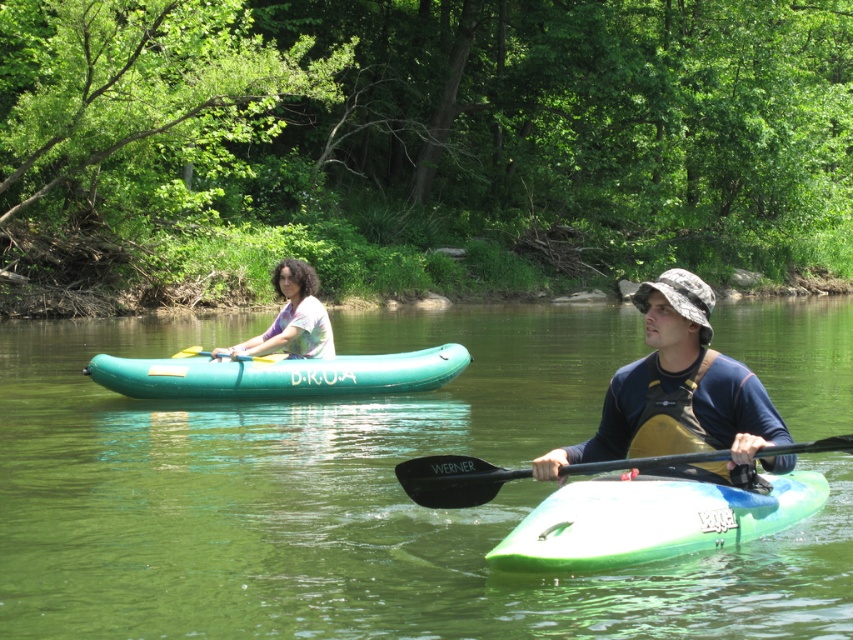
Between green rubber kayak at center and black rubber paddle at upper center, which one appears on the right side from the viewer's perspective?

green rubber kayak at center is more to the right.

What do you see at coordinates (350, 497) in the screenshot?
I see `green rubber kayak at center` at bounding box center [350, 497].

You are a GUI agent. You are given a task and a screenshot of the screen. Output one action in this format:
    pyautogui.click(x=<x>, y=<y>)
    Task: Click on the green rubber kayak at center
    
    Given the screenshot: What is the action you would take?
    pyautogui.click(x=350, y=497)

What do you see at coordinates (650, 520) in the screenshot? I see `green plastic kayak at center` at bounding box center [650, 520].

Is green plastic kayak at center taller than black rubber paddle at upper center?

Yes.

Who is more distant from viewer, (785, 490) or (235, 358)?

Positioned behind is point (235, 358).

Identify the location of green plastic kayak at center. Image resolution: width=853 pixels, height=640 pixels. (650, 520).

Between point (592, 458) and point (190, 353), which one is positioned behind?

Point (190, 353)

Where is `camouflage fabric hat at center`? camouflage fabric hat at center is located at coordinates (676, 388).